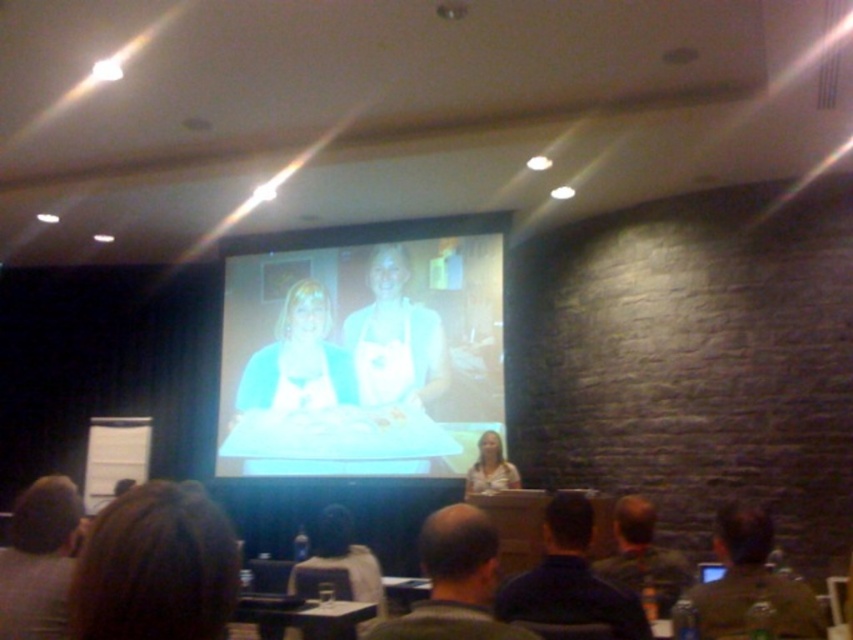
Which is below, bald head at center or brown hair at upper left?

bald head at center

Is bald head at center below brown hair at upper left?

Correct, bald head at center is located below brown hair at upper left.

Who is more forward, (462, 600) or (3, 602)?

Point (462, 600) is more forward.

You are a GUI agent. You are given a task and a screenshot of the screen. Output one action in this format:
    pyautogui.click(x=<x>, y=<y>)
    Task: Click on the bald head at center
    
    Given the screenshot: What is the action you would take?
    point(454,580)

Is brown hair at lower left positioned in front of dark brown hair at center?

Yes, it is in front of dark brown hair at center.

Locate an element on the screen. This screenshot has height=640, width=853. brown hair at lower left is located at coordinates (155, 566).

Which is below, matte white screen at center or dark blue shirt at lower center?

dark blue shirt at lower center is below.

Is point (241, 406) closer to viewer compared to point (583, 544)?

No, it is behind (583, 544).

Where is `matte white screen at center`? The height and width of the screenshot is (640, 853). matte white screen at center is located at coordinates (363, 348).